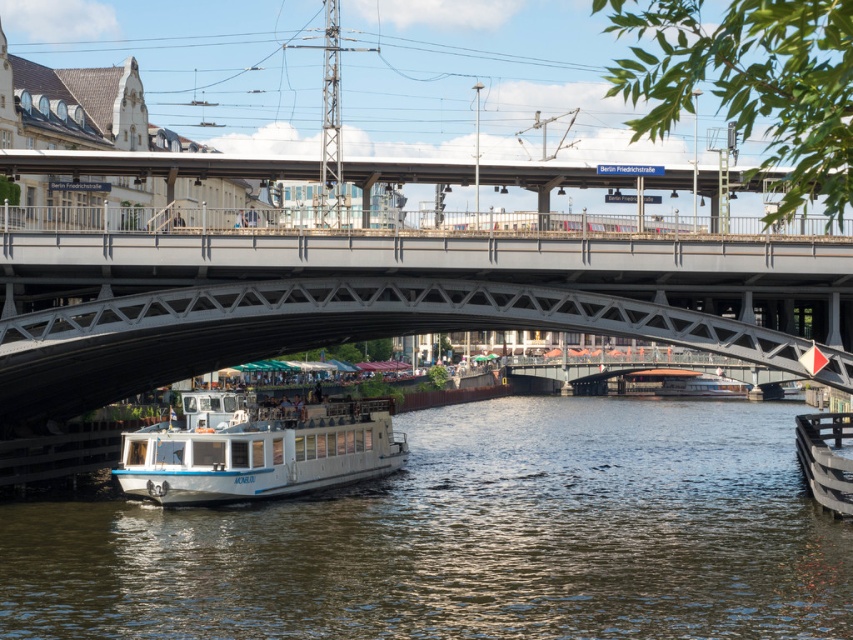
Question: Can you confirm if white glossy water at center is positioned to the right of metallic gray bridge at center?

Choices:
 (A) no
 (B) yes

Answer: (B)

Question: Which point appears farthest from the camera in this image?

Choices:
 (A) (735, 387)
 (B) (323, 436)
 (C) (184, 326)

Answer: (A)

Question: Where is white glossy water at center located in relation to white glossy boat at lower center in the image?

Choices:
 (A) below
 (B) above

Answer: (A)

Question: Which object is positioned closest to the white glossy boat at lower center?

Choices:
 (A) white glossy boat at center
 (B) white glossy water at center

Answer: (B)

Question: Does metallic gray bridge at center have a smaller size compared to white glossy boat at center?

Choices:
 (A) yes
 (B) no

Answer: (B)

Question: Which object is positioned closest to the white glossy boat at lower center?

Choices:
 (A) metallic gray bridge at center
 (B) white glossy water at center
 (C) white glossy boat at center

Answer: (A)